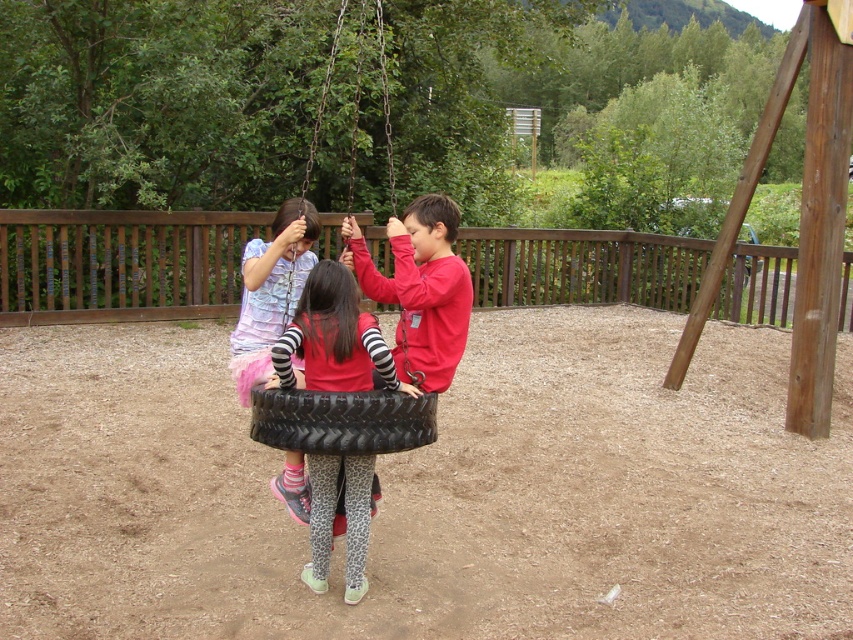
You are standing at the point marked by the coordinates point (x=270, y=291) in the playground scene. There is a striped fabric dress at center. Which direction should you move to reach the striped fabric dress at center?

The point marked by point (x=270, y=291) is already at the location of the striped fabric dress at center, so you are already there.

You are a photographer trying to capture a photo of the children pulling the tire swing. You want to ensure both the red matte shirt at center and the striped fabric dress at center are visible in the frame. Which child should you focus on first to ensure both are in the shot?

The red matte shirt at center is shorter than the striped fabric dress at center. Therefore, you should focus on the striped fabric dress at center first to ensure both are visible in the frame.

You are a parent supervising children at the playground. You notice the red matte shirt at center and the black rubber tire at center. Which child is closer to the left side of the tire?

The red matte shirt at center is positioned on the left side of the black rubber tire at center, so the child wearing the red matte shirt at center is closer to the left side of the tire.